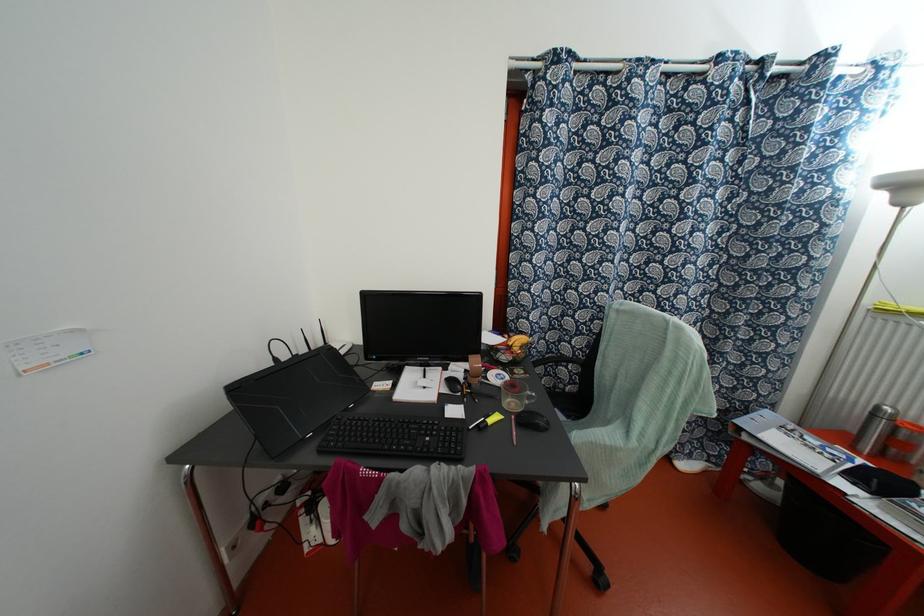
The location [873,429] corresponds to which object?

It corresponds to the small brown container in the image.